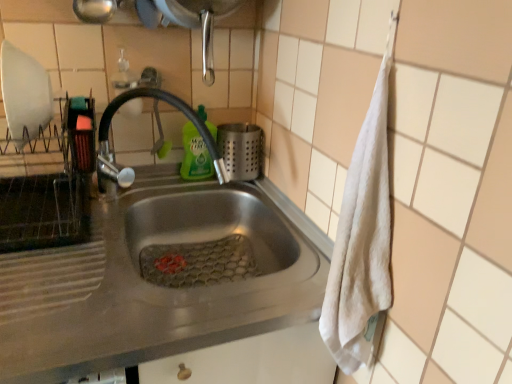
Question: Would you say satin silver utensil holder at sink is outside green liquid at sink?

Choices:
 (A) no
 (B) yes

Answer: (B)

Question: Is green liquid at sink at the back of satin silver utensil holder at sink?

Choices:
 (A) yes
 (B) no

Answer: (B)

Question: Is satin silver utensil holder at sink bigger than green liquid at sink?

Choices:
 (A) yes
 (B) no

Answer: (A)

Question: Is satin silver utensil holder at sink facing towards green liquid at sink?

Choices:
 (A) yes
 (B) no

Answer: (B)

Question: Can you see satin silver utensil holder at sink touching green liquid at sink?

Choices:
 (A) no
 (B) yes

Answer: (B)

Question: Is green liquid at sink to the left or to the right of shiny metallic faucet at center in the image?

Choices:
 (A) left
 (B) right

Answer: (B)

Question: Which is correct: green liquid at sink is inside shiny metallic faucet at center, or outside of it?

Choices:
 (A) outside
 (B) inside

Answer: (B)

Question: Looking at their shapes, would you say green liquid at sink is wider or thinner than shiny metallic faucet at center?

Choices:
 (A) thin
 (B) wide

Answer: (A)

Question: From a real-world perspective, is green liquid at sink physically located above or below shiny metallic faucet at center?

Choices:
 (A) above
 (B) below

Answer: (B)

Question: From the image's perspective, is stainless steel sink at center located above or below green liquid at sink?

Choices:
 (A) above
 (B) below

Answer: (B)

Question: Is point (18, 218) closer or farther from the camera than point (184, 148)?

Choices:
 (A) closer
 (B) farther

Answer: (A)

Question: From a real-world perspective, is stainless steel sink at center positioned above or below green liquid at sink?

Choices:
 (A) below
 (B) above

Answer: (A)

Question: Do you think stainless steel sink at center is within green liquid at sink, or outside of it?

Choices:
 (A) inside
 (B) outside

Answer: (B)

Question: Is stainless steel sink at center spatially inside satin silver utensil holder at sink, or outside of it?

Choices:
 (A) outside
 (B) inside

Answer: (A)

Question: Considering the positions of stainless steel sink at center and satin silver utensil holder at sink in the image, is stainless steel sink at center taller or shorter than satin silver utensil holder at sink?

Choices:
 (A) tall
 (B) short

Answer: (A)